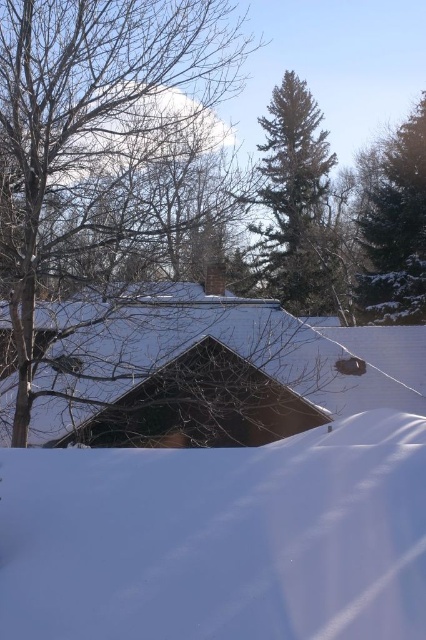
You are an observer standing in the winter scene. You see the white fluffy snow at lower center and the bare branches at left. Which object is taller?

The bare branches at left are taller than the white fluffy snow at lower center.

You are an observer standing in the winter scene described. You notice the bare branches at left and the green textured evergreen tree at upper right. Which object is positioned lower in the scene?

The bare branches at left is positioned lower in the scene than the green textured evergreen tree at upper right.

From the picture: You are standing in the winter scene and want to take a photo of the white fluffy snow at lower center and the bare branches at left. Which object should you focus on first if you want to capture both in a single frame without moving the camera?

You should focus on the white fluffy snow at lower center first because it is located below the bare branches at left, so adjusting the camera to include both would require ensuring the lower object is in frame.